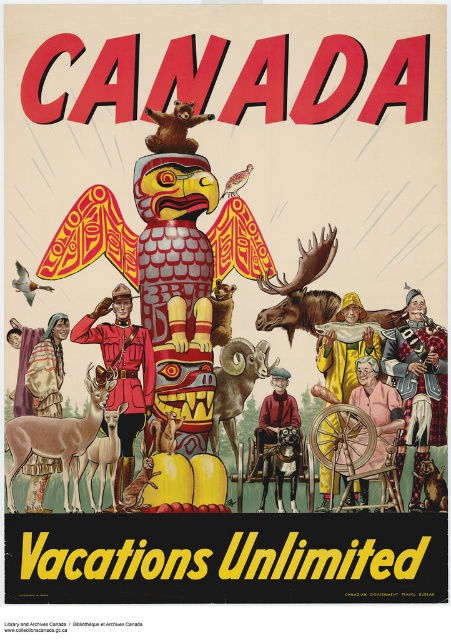
You are standing at the bottom of the poster and looking upward. Which of the two points, point (198, 320) or point (128, 509), is closer to you?

Point (128, 509) is closer to you because it is in front of point (198, 320).